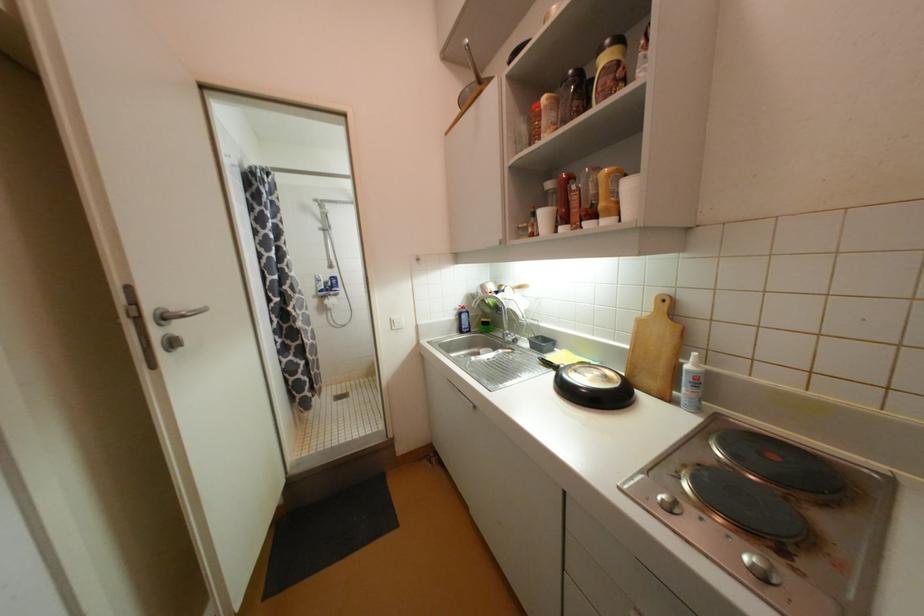
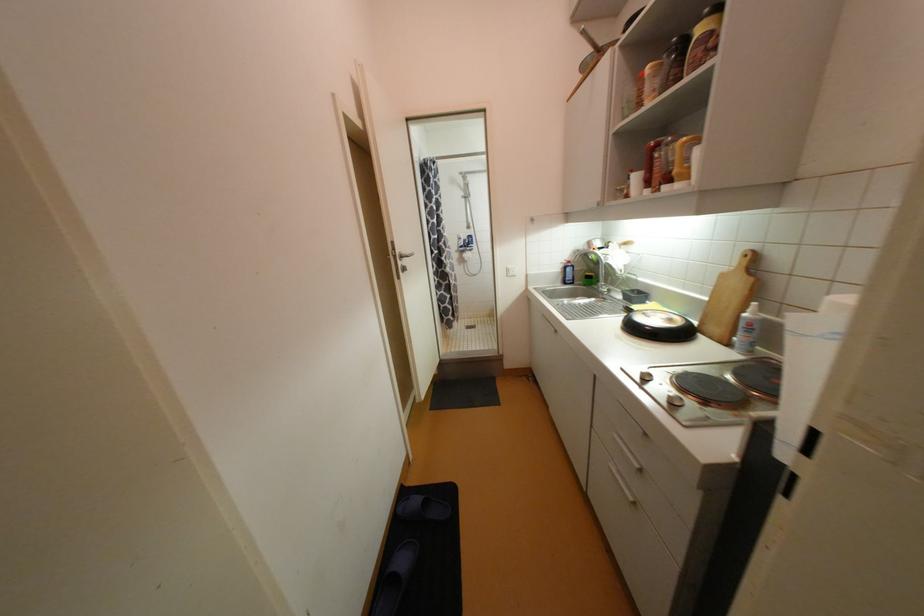
Where in the second image is the point corresponding to point 396,323 from the first image?

(513, 270)